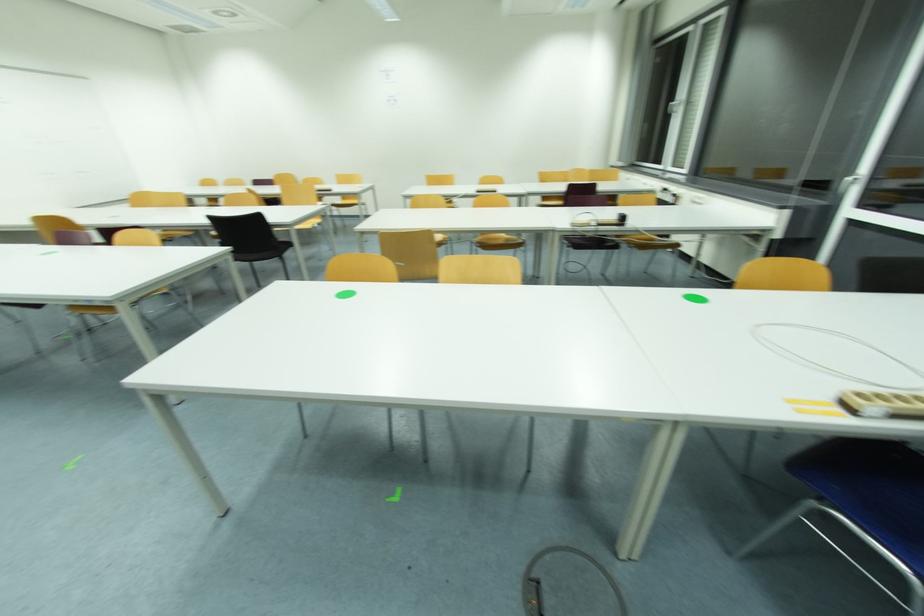
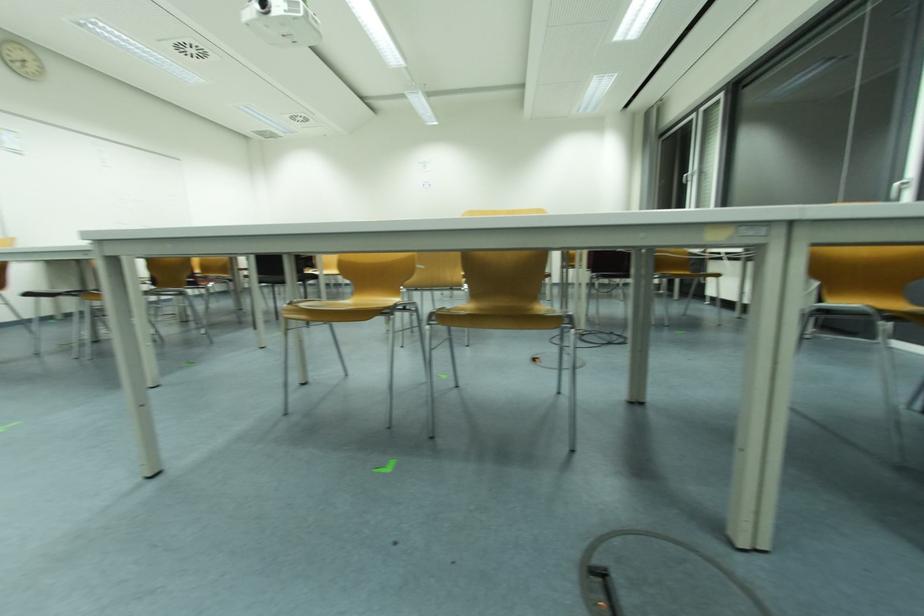
Question: The images are taken continuously from a first-person perspective. In which direction are you moving?

Choices:
 (A) Left
 (B) Right
 (C) Forward
 (D) Backward

Answer: (C)